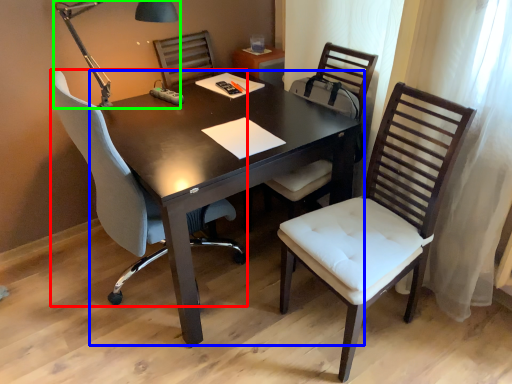
Question: Which is nearer to the chair (highlighted by a red box)? table (highlighted by a blue box) or table lamp (highlighted by a green box).

Choices:
 (A) table
 (B) table lamp

Answer: (A)